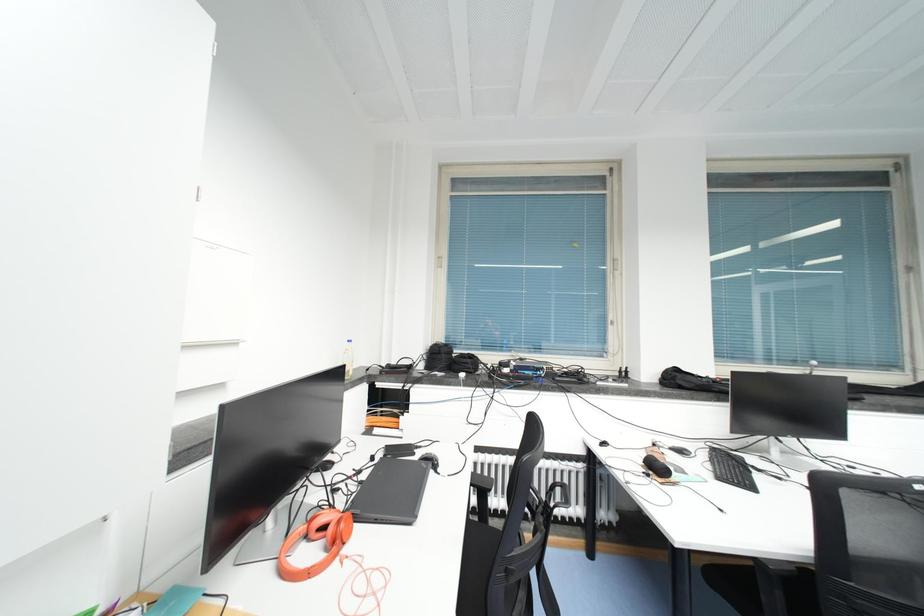
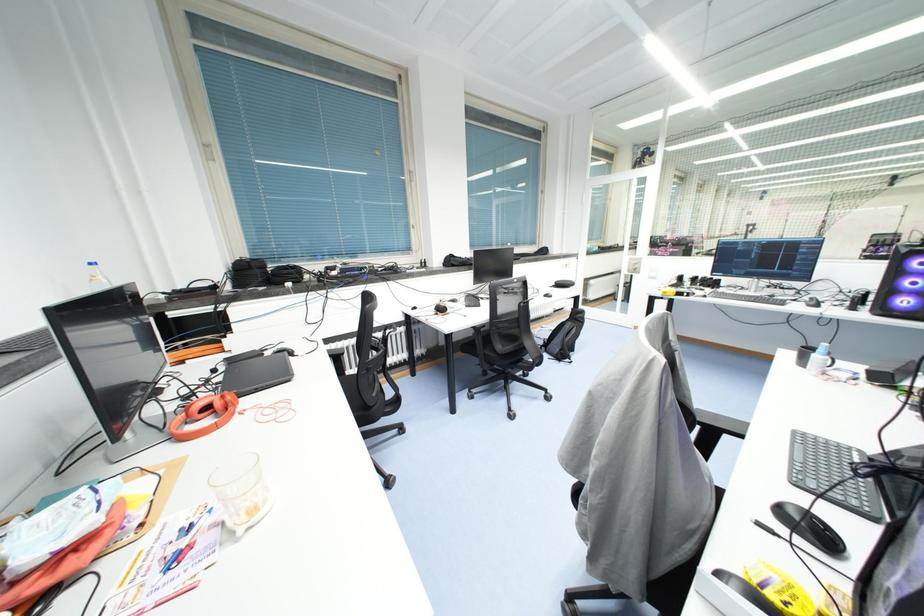
The first image is from the beginning of the video and the second image is from the end. How did the camera likely rotate when shooting the video?

The rotation direction of the camera is right-down.